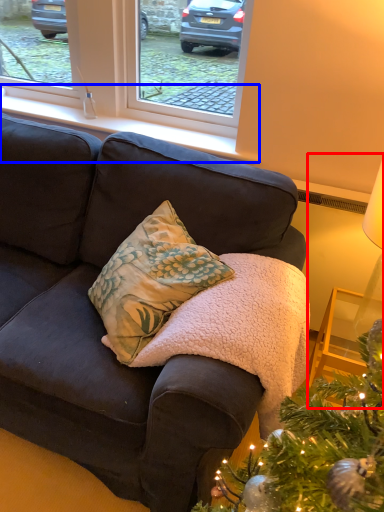
Question: Which point is closer to the camera, table lamp (highlighted by a red box) or window sill (highlighted by a blue box)?

Choices:
 (A) table lamp
 (B) window sill

Answer: (A)